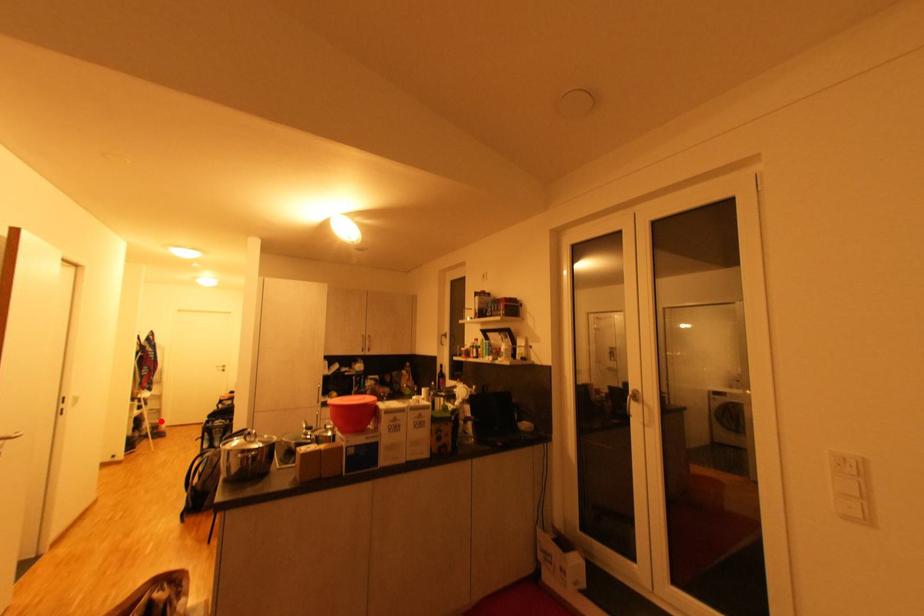
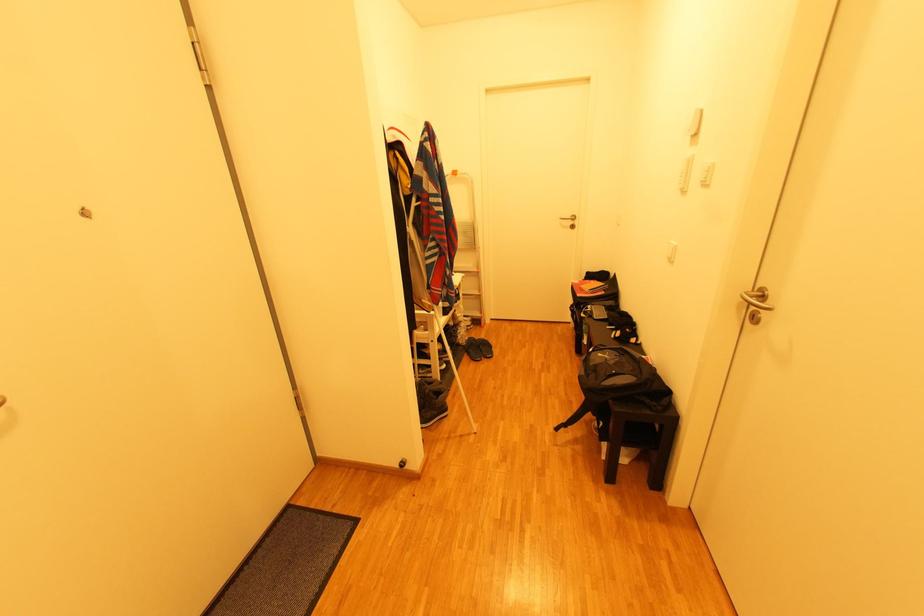
In the second image, find the point that corresponds to the highlighted location in the first image.

(481, 315)